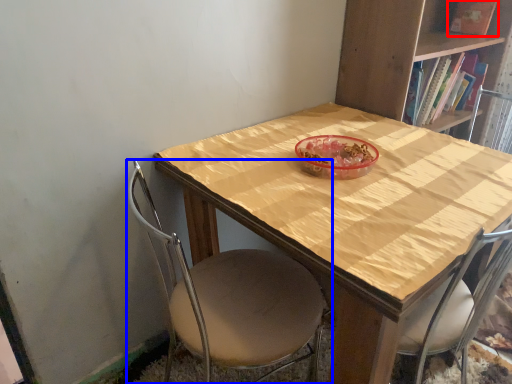
Question: Which object is closer to the camera taking this photo, book (highlighted by a red box) or chair (highlighted by a blue box)?

Choices:
 (A) book
 (B) chair

Answer: (B)